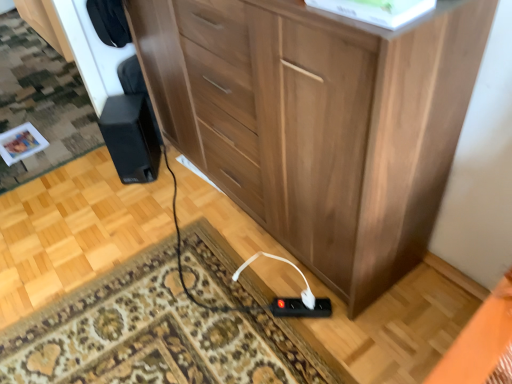
Question: From a real-world perspective, is white plastic plug at lower center, positioned as the second plug in left-to-right order, located beneath black plastic power strip at lower center, positioned as the first plug in left-to-right order?

Choices:
 (A) no
 (B) yes

Answer: (A)

Question: Is white plastic plug at lower center, positioned as the second plug in left-to-right order, thinner than black plastic power strip at lower center, which is counted as the 2th plug, starting from the right?

Choices:
 (A) no
 (B) yes

Answer: (B)

Question: Would you say white plastic plug at lower center, positioned as the second plug in left-to-right order, is a long distance from black plastic power strip at lower center, which is counted as the 2th plug, starting from the right?

Choices:
 (A) no
 (B) yes

Answer: (A)

Question: Considering the relative sizes of white plastic plug at lower center, the first plug from the right, and black plastic power strip at lower center, which is counted as the 2th plug, starting from the right, in the image provided, is white plastic plug at lower center, the first plug from the right, wider than black plastic power strip at lower center, which is counted as the 2th plug, starting from the right,?

Choices:
 (A) no
 (B) yes

Answer: (A)

Question: Is white plastic plug at lower center, positioned as the second plug in left-to-right order, facing away from black plastic power strip at lower center, positioned as the first plug in left-to-right order?

Choices:
 (A) yes
 (B) no

Answer: (B)

Question: From a real-world perspective, is white plastic plug at lower center, the first plug from the right, physically located above or below black plastic power strip at lower center, positioned as the first plug in left-to-right order?

Choices:
 (A) above
 (B) below

Answer: (A)

Question: In terms of height, does white plastic plug at lower center, positioned as the second plug in left-to-right order, look taller or shorter compared to black plastic power strip at lower center, which is counted as the 2th plug, starting from the right?

Choices:
 (A) short
 (B) tall

Answer: (A)

Question: Is white plastic plug at lower center, positioned as the second plug in left-to-right order, situated inside black plastic power strip at lower center, positioned as the first plug in left-to-right order, or outside?

Choices:
 (A) outside
 (B) inside

Answer: (B)

Question: Is white plastic plug at lower center, positioned as the second plug in left-to-right order, wider or thinner than black plastic power strip at lower center, positioned as the first plug in left-to-right order?

Choices:
 (A) wide
 (B) thin

Answer: (B)

Question: Considering the positions of black matte speaker at lower left and black plastic power strip at lower center, positioned as the first plug in left-to-right order, in the image, is black matte speaker at lower left bigger or smaller than black plastic power strip at lower center, positioned as the first plug in left-to-right order,?

Choices:
 (A) big
 (B) small

Answer: (A)

Question: From a real-world perspective, is black matte speaker at lower left physically located above or below black plastic power strip at lower center, positioned as the first plug in left-to-right order?

Choices:
 (A) above
 (B) below

Answer: (A)

Question: Considering their positions, is black matte speaker at lower left located in front of or behind black plastic power strip at lower center, positioned as the first plug in left-to-right order?

Choices:
 (A) front
 (B) behind

Answer: (B)

Question: Is black matte speaker at lower left wider or thinner than black plastic power strip at lower center, which is counted as the 2th plug, starting from the right?

Choices:
 (A) thin
 (B) wide

Answer: (B)

Question: Considering the positions of black plastic power strip at lower center, which is counted as the 2th plug, starting from the right, and black matte speaker at lower left in the image, is black plastic power strip at lower center, which is counted as the 2th plug, starting from the right, wider or thinner than black matte speaker at lower left?

Choices:
 (A) wide
 (B) thin

Answer: (B)

Question: Is black plastic power strip at lower center, positioned as the first plug in left-to-right order, taller or shorter than black matte speaker at lower left?

Choices:
 (A) short
 (B) tall

Answer: (A)